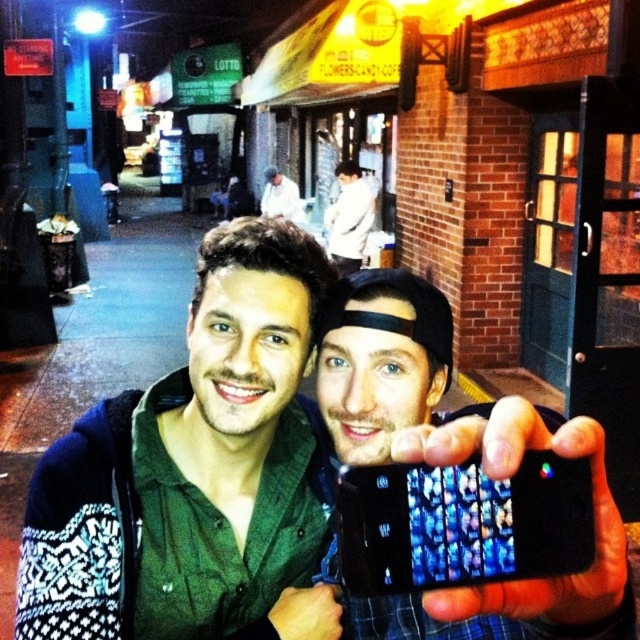
Consider the image. Between green matte shirt at center and white cotton shirt at center, which one is positioned lower?

green matte shirt at center

Is green matte shirt at center above white cotton shirt at center?

No.

Locate an element on the screen. green matte shirt at center is located at coordinates click(195, 472).

Between green matte shirt at center and black matte phone at center, which one has more height?

With more height is green matte shirt at center.

Can you confirm if green matte shirt at center is positioned to the right of black matte phone at center?

No, green matte shirt at center is not to the right of black matte phone at center.

Find the location of a particular element. The height and width of the screenshot is (640, 640). green matte shirt at center is located at coordinates (195, 472).

What are the coordinates of `green matte shirt at center` in the screenshot? It's located at (195, 472).

Between point (580, 628) and point (499, 600), which one is positioned in front?

Point (499, 600) is more forward.

Is black glossy phone at center taller than black matte phone at center?

Indeed, black glossy phone at center has a greater height compared to black matte phone at center.

Identify the location of black glossy phone at center. The height and width of the screenshot is (640, 640). (454, 464).